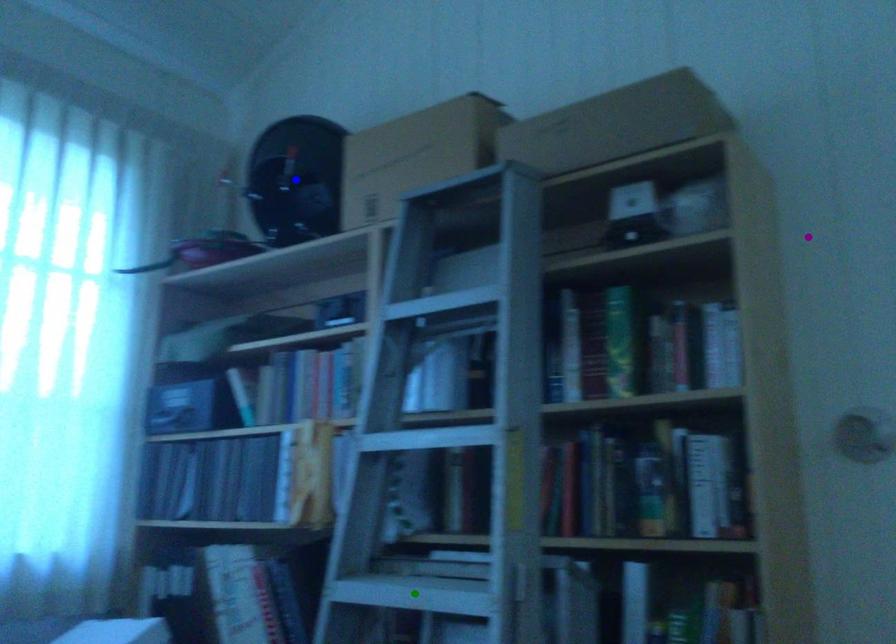
Order these from nearest to farthest:
1. purple point
2. blue point
3. green point

green point
purple point
blue point